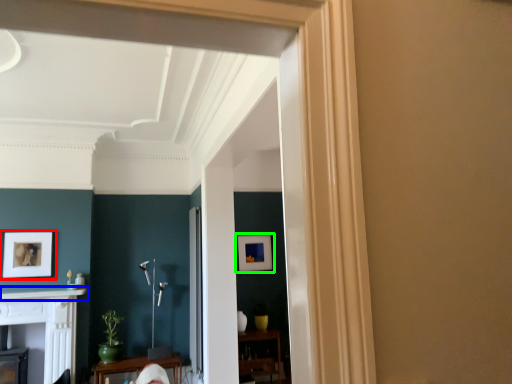
Question: Which object is the farthest from picture frame (highlighted by a red box)? Choose among these: mantle (highlighted by a blue box) or picture frame (highlighted by a green box).

Choices:
 (A) mantle
 (B) picture frame

Answer: (B)